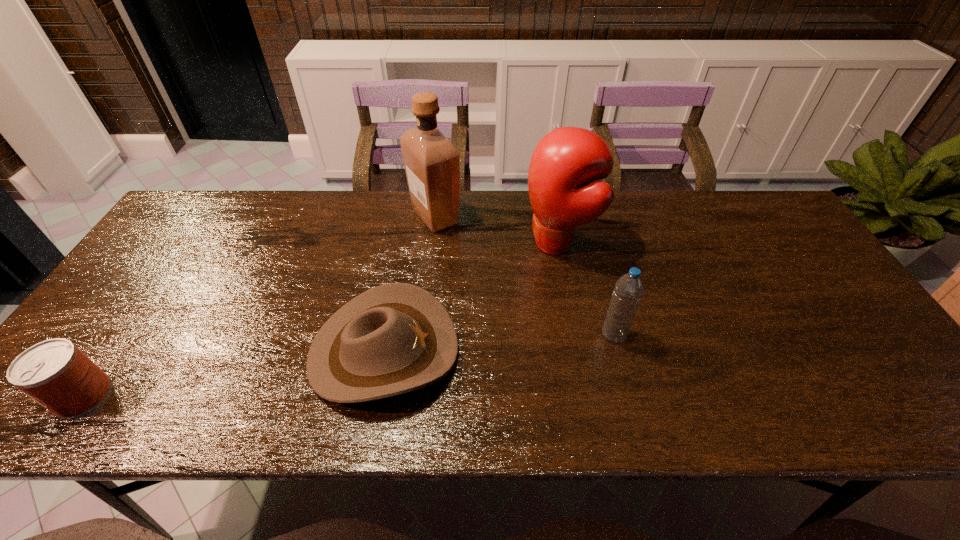
Where is `free spot located 0.400m on the right of the can`? free spot located 0.400m on the right of the can is located at coordinates (294, 395).

I want to click on vacant area situated with a star on the front of the cowboy hat, so click(x=557, y=351).

You are a GUI agent. You are given a task and a screenshot of the screen. Output one action in this format:
    pyautogui.click(x=<x>, y=<y>)
    Task: Click on the liquor present at the far edge
    This screenshot has width=960, height=540.
    Given the screenshot: What is the action you would take?
    pyautogui.click(x=432, y=162)

The width and height of the screenshot is (960, 540). I want to click on boxing glove that is positioned at the far edge, so click(565, 161).

What are the coordinates of `can located in the near edge section of the desktop` in the screenshot? It's located at (55, 373).

You are a GUI agent. You are given a task and a screenshot of the screen. Output one action in this format:
    pyautogui.click(x=<x>, y=<y>)
    Task: Click on the cowboy hat present at the near edge
    This screenshot has width=960, height=540.
    Given the screenshot: What is the action you would take?
    pyautogui.click(x=395, y=338)

The height and width of the screenshot is (540, 960). Find the location of `object that is at the left edge`. object that is at the left edge is located at coordinates (55, 373).

Identify the location of object that is at the near left corner. The image size is (960, 540). (55, 373).

At what (x,y) coordinates should I click in order to perform the action: click on free spot at the far edge of the desktop. Please return your answer as a coordinate pair (x, y). This screenshot has height=540, width=960. Looking at the image, I should click on point(375,235).

In the image, there is a desktop. Identify the location of vacant space at the near edge. (236, 412).